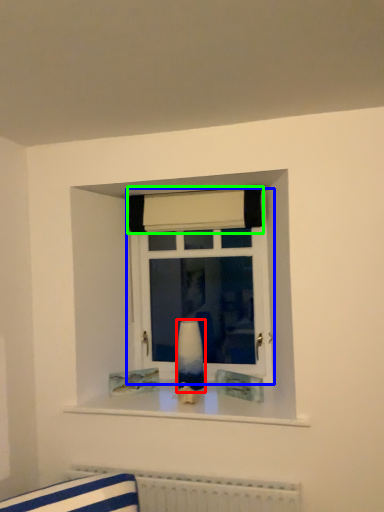
Question: Which object is the closest to the vase (highlighted by a red box)? Choose among these: window (highlighted by a blue box) or curtain (highlighted by a green box).

Choices:
 (A) window
 (B) curtain

Answer: (A)